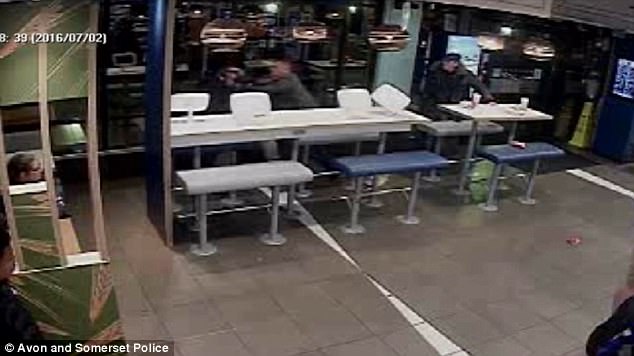
In order to click on wall in this screenshot , I will do `click(152, 141)`.